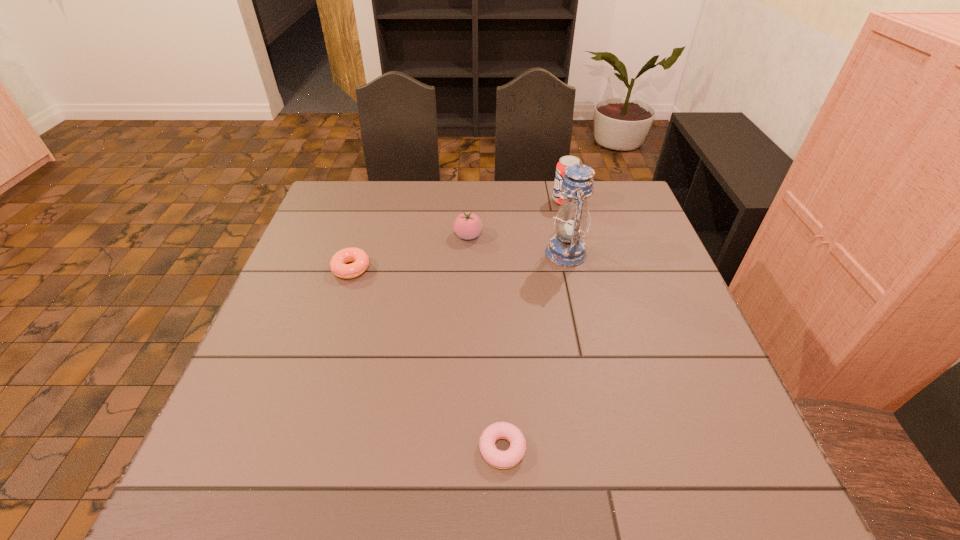
I want to click on the tallest object, so click(x=566, y=248).

Locate an element on the screen. The image size is (960, 540). the fourth shortest object is located at coordinates (564, 161).

At what (x,y) coordinates should I click in order to perform the action: click on the farthest object. Please return your answer as a coordinate pair (x, y). This screenshot has height=540, width=960. Looking at the image, I should click on (564, 161).

Locate an element on the screen. This screenshot has width=960, height=540. tomato is located at coordinates (467, 225).

Find the location of a particular element. the fourth tallest object is located at coordinates pos(339,267).

The image size is (960, 540). Find the location of `the farther doughnut`. the farther doughnut is located at coordinates (339, 267).

Locate an element on the screen. the nearest object is located at coordinates (511, 457).

Find the location of a particular element. the right doughnut is located at coordinates (511, 457).

Image resolution: width=960 pixels, height=540 pixels. Find the location of `free space located on the front-facing side of the tallest object`. free space located on the front-facing side of the tallest object is located at coordinates (416, 253).

Image resolution: width=960 pixels, height=540 pixels. Find the location of `blank space located 0.390m on the front-facing side of the tallest object`. blank space located 0.390m on the front-facing side of the tallest object is located at coordinates (405, 253).